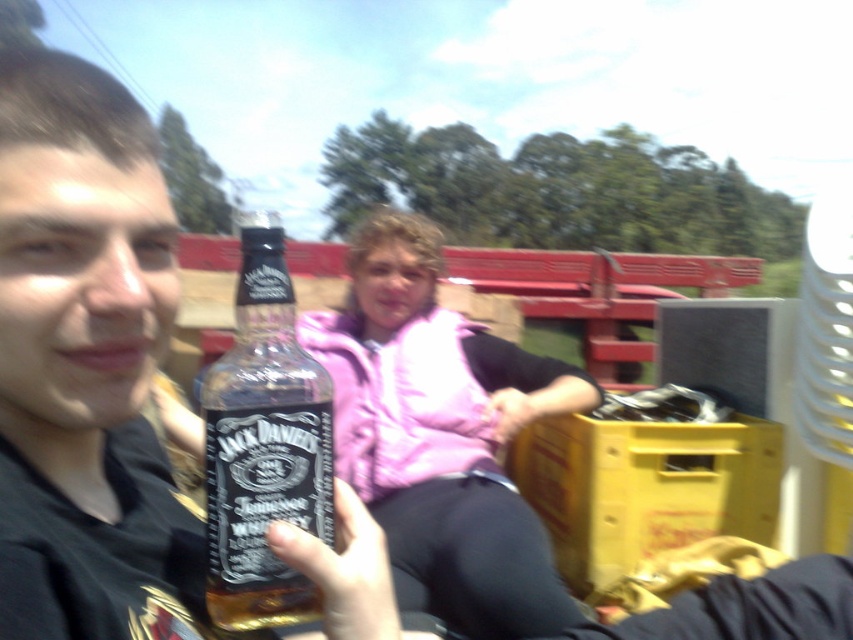
You are a photographer trying to capture the matte glass bottle at center and the clear glass bottle at center in a single shot. Since you can only focus on one bottle clearly, which one should you choose to ensure it appears sharp in the photo?

You should focus on the matte glass bottle at center because it is closer to the viewer than the clear glass bottle at center, making it easier to capture sharply in the photo.

You are standing at the point closest to the whiskey bottle in the scene. Which of the two points, point (15, 365) or point (236, 307), is closer to you?

Point (15, 365) is in front of point (236, 307), so it is closer to you.

From the picture: You are a photographer trying to capture a closeup shot of the pink fabric vest at center. You have a camera with a 3.5 feet minimum focusing distance. Can you take the photo without moving either the vest or the camera?

The pink fabric vest at center and camera are 3.67 feet apart, which is just beyond the camera lens minimum focusing distance of 3.5 feet. Therefore, you cannot take the photo without moving either the vest or the camera.